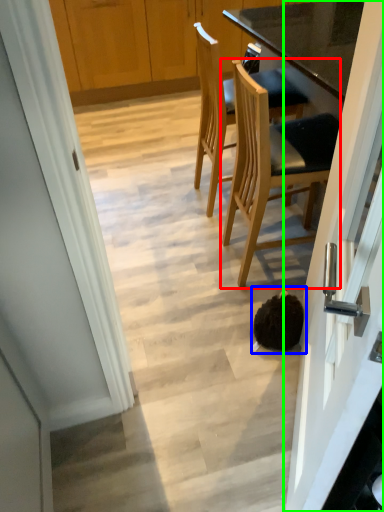
Question: Which is nearer to the chair (highlighted by a red box)? head (highlighted by a blue box) or door (highlighted by a green box).

Choices:
 (A) head
 (B) door

Answer: (A)